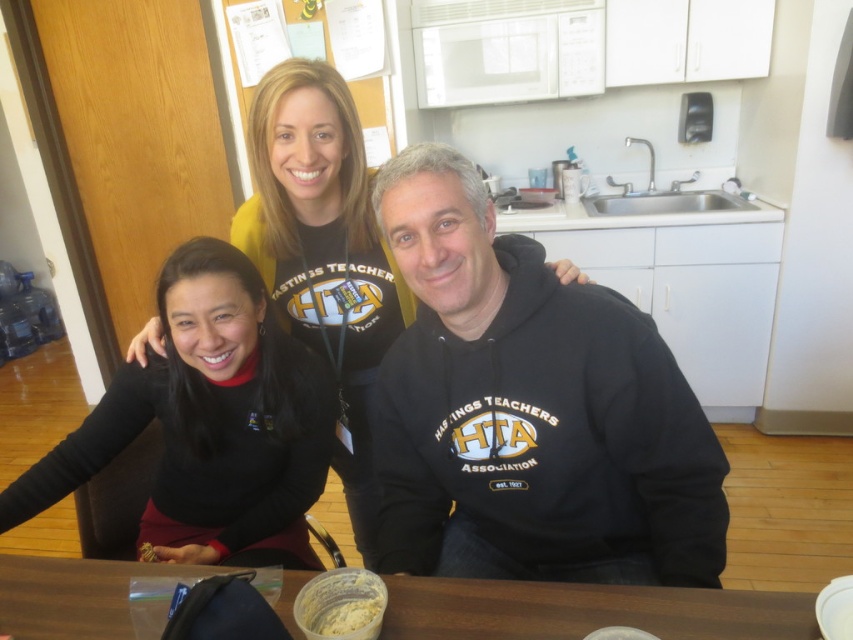
Question: Can you confirm if black hoodie at center is thinner than black matte sweater at lower left?

Choices:
 (A) yes
 (B) no

Answer: (A)

Question: Does black matte sweater at lower left appear over black matte shirt at center?

Choices:
 (A) yes
 (B) no

Answer: (B)

Question: Among these objects, which one is nearest to the camera?

Choices:
 (A) black hoodie at center
 (B) black matte sweater at lower left
 (C) brown wooden table at lower center

Answer: (C)

Question: Which point is farther to the camera?

Choices:
 (A) (350, 337)
 (B) (587, 589)
 (C) (357, 568)
 (D) (257, 339)

Answer: (A)

Question: Is brown wooden table at lower center bigger than white creamy paste at lower center?

Choices:
 (A) yes
 (B) no

Answer: (A)

Question: Based on their relative distances, which object is nearer to the white creamy paste at lower center?

Choices:
 (A) black matte shirt at center
 (B) black hoodie at center
 (C) black matte sweater at lower left

Answer: (B)